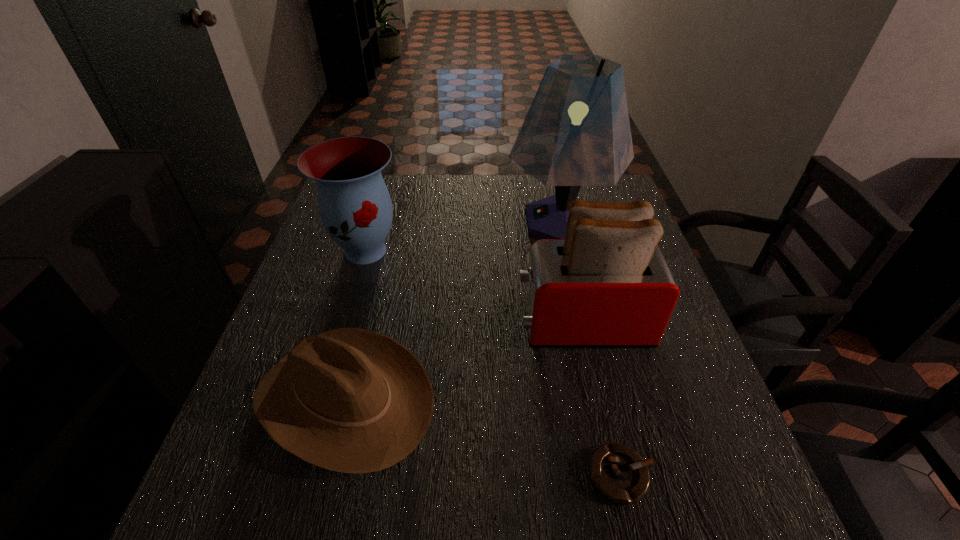
This screenshot has width=960, height=540. Find the location of `the tallest object`. the tallest object is located at coordinates (576, 133).

Where is `toaster`? toaster is located at coordinates (606, 285).

Locate an element on the screen. The image size is (960, 540). vase is located at coordinates (355, 207).

Where is `cowboy hat`? The height and width of the screenshot is (540, 960). cowboy hat is located at coordinates (351, 400).

Where is `the shortest object`? The image size is (960, 540). the shortest object is located at coordinates (619, 473).

The height and width of the screenshot is (540, 960). In order to click on vacant space located 0.190m on the base of the lampshade in this screenshot , I will do `click(441, 221)`.

The image size is (960, 540). What are the coordinates of `vacant region located on the base of the lampshade` in the screenshot? It's located at (447, 221).

Where is `vacant region located 0.300m on the base of the lampshade`? The width and height of the screenshot is (960, 540). vacant region located 0.300m on the base of the lampshade is located at coordinates (403, 221).

Where is `blank space located on the front-facing side of the toaster`? blank space located on the front-facing side of the toaster is located at coordinates (445, 324).

Find the location of `vacant space located 0.130m on the front-facing side of the toaster`. vacant space located 0.130m on the front-facing side of the toaster is located at coordinates (459, 324).